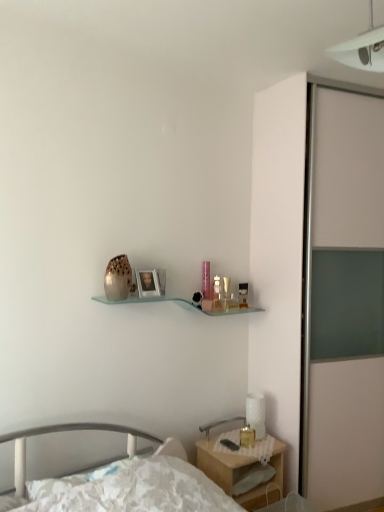
The height and width of the screenshot is (512, 384). I want to click on vacant area in front of white textured table lamp at lower right, so click(259, 441).